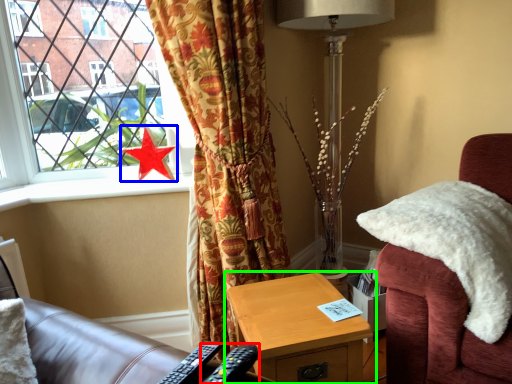
Question: Estimate the real-world distances between objects in this image. Which object is farther from remote control (highlighted by a red box), star (highlighted by a blue box) or nightstand (highlighted by a green box)?

Choices:
 (A) star
 (B) nightstand

Answer: (A)